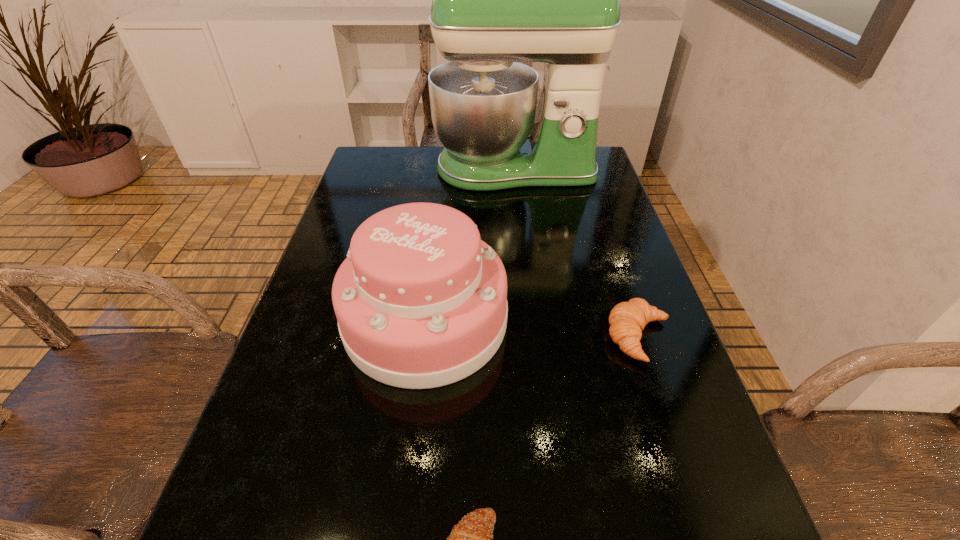
Find the location of `mixer`. mixer is located at coordinates (497, 0).

Find the location of a particular element. This screenshot has height=540, width=960. the tallest object is located at coordinates (497, 0).

Find the location of a particular element. This screenshot has width=960, height=540. the third shortest object is located at coordinates (421, 302).

You are a GUI agent. You are given a task and a screenshot of the screen. Output one action in this format:
    pyautogui.click(x=<x>, y=<y>)
    Task: Click on the third tallest object
    The width and height of the screenshot is (960, 540).
    Given the screenshot: What is the action you would take?
    pyautogui.click(x=627, y=320)

This screenshot has height=540, width=960. I want to click on the farther crescent roll, so click(627, 320).

The image size is (960, 540). In order to click on vacant space located on the controls of the farthest object in this screenshot , I will do [521, 225].

Where is `vacant space positioned 0.400m on the back of the third shortest object`? vacant space positioned 0.400m on the back of the third shortest object is located at coordinates (443, 177).

The width and height of the screenshot is (960, 540). Find the location of `vacant region located 0.260m on the front of the farther crescent roll`. vacant region located 0.260m on the front of the farther crescent roll is located at coordinates (701, 519).

Identify the location of object positioned at the far edge. This screenshot has width=960, height=540. (497, 0).

The width and height of the screenshot is (960, 540). What are the coordinates of `object at the left edge` in the screenshot? It's located at click(x=421, y=302).